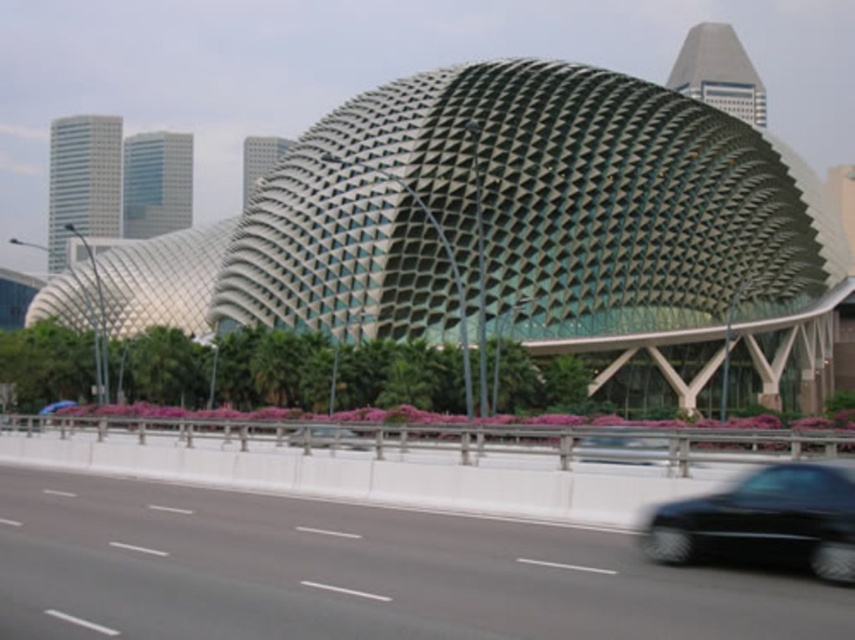
You are a photographer standing on the sidewalk near the road. You want to capture a photo that includes both the green metallic dome at center and the shiny black car at lower right. Which object should you position closer to the center of your camera frame to ensure both are visible?

The green metallic dome at center is taller than the shiny black car at lower right, so positioning the dome closer to the center of your camera frame will ensure both are visible while accounting for their size difference.

You are driving a car and see the image. You want to merge onto the gray asphalt highway at lower center from the road you are currently on. Is the shiny black car at lower right in your path?

The gray asphalt highway at lower center is to the left of the shiny black car at lower right, so the shiny black car at lower right is not in your path when merging onto the gray asphalt highway at lower center.

You are a pedestrian standing on the sidewalk. You see the gray asphalt highway at lower center and the shiny black car at lower right. Which object is closer to your position?

The gray asphalt highway at lower center is closer to your position because it is located below the shiny black car at lower right, placing it nearer to the pedestrian.